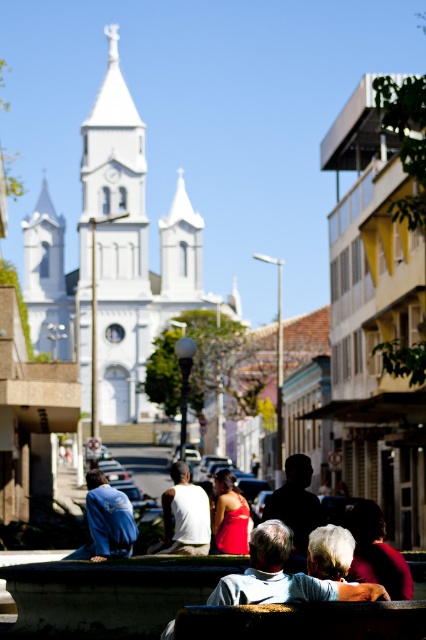
Question: Which point is farther to the camera?

Choices:
 (A) shiny red dress at center
 (B) wooden park bench at lower center

Answer: (A)

Question: Can you confirm if wooden park bench at lower center is thinner than blue denim jacket at lower left?

Choices:
 (A) no
 (B) yes

Answer: (A)

Question: Is white smooth church at center positioned behind silhouette figure at center?

Choices:
 (A) yes
 (B) no

Answer: (A)

Question: Can you confirm if wooden park bench at lower center is positioned above silhouette figure at center?

Choices:
 (A) no
 (B) yes

Answer: (A)

Question: Among these objects, which one is nearest to the camera?

Choices:
 (A) white smooth church at center
 (B) wooden park bench at lower center
 (C) dark red fabric at lower right
 (D) blue denim jacket at lower left

Answer: (B)

Question: Which object is farther from the camera taking this photo?

Choices:
 (A) white matte tank top at center
 (B) wooden park bench at lower center
 (C) silhouette figure at center
 (D) shiny red dress at center

Answer: (A)